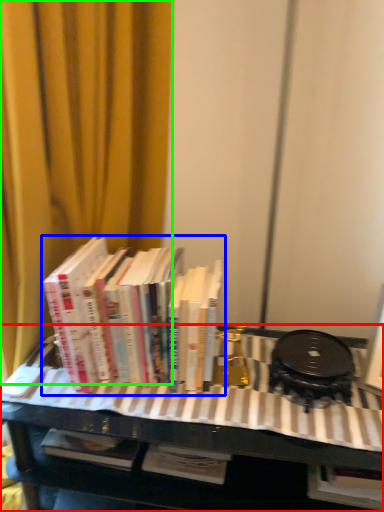
Question: Which object is positioned closest to table (highlighted by a red box)? Select from book (highlighted by a blue box) and curtain (highlighted by a green box).

Choices:
 (A) book
 (B) curtain

Answer: (A)